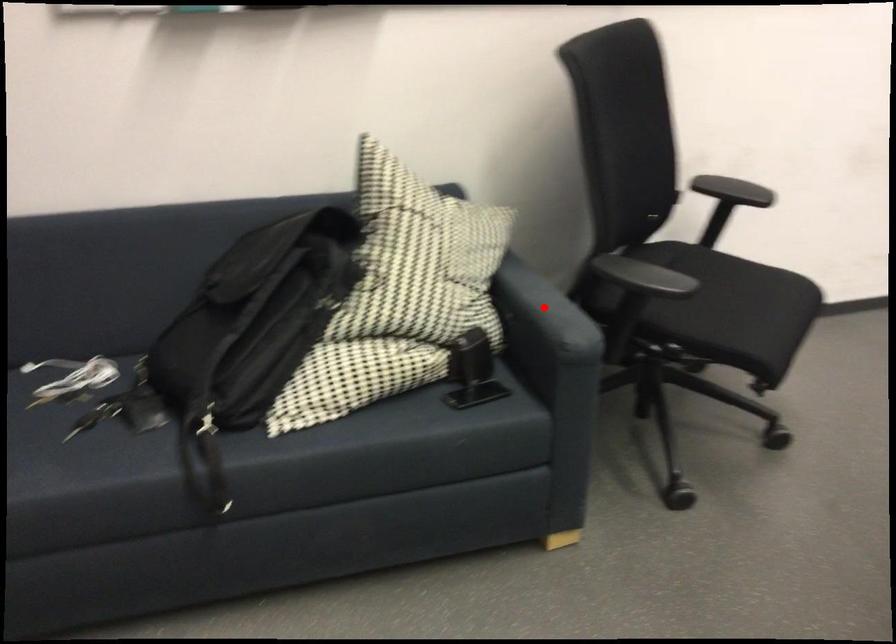
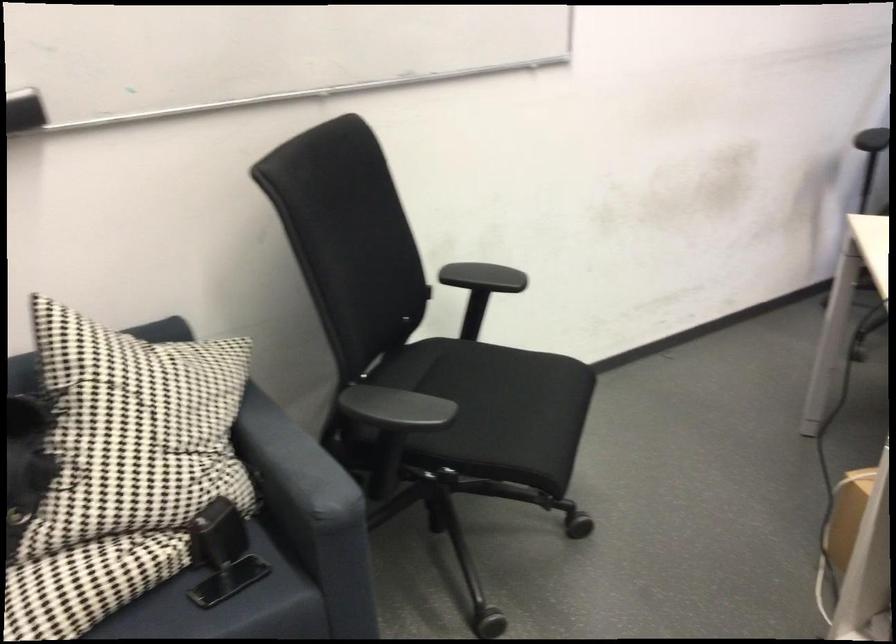
Locate, in the second image, the point that corresponds to the highlighted location in the first image.

(293, 464)